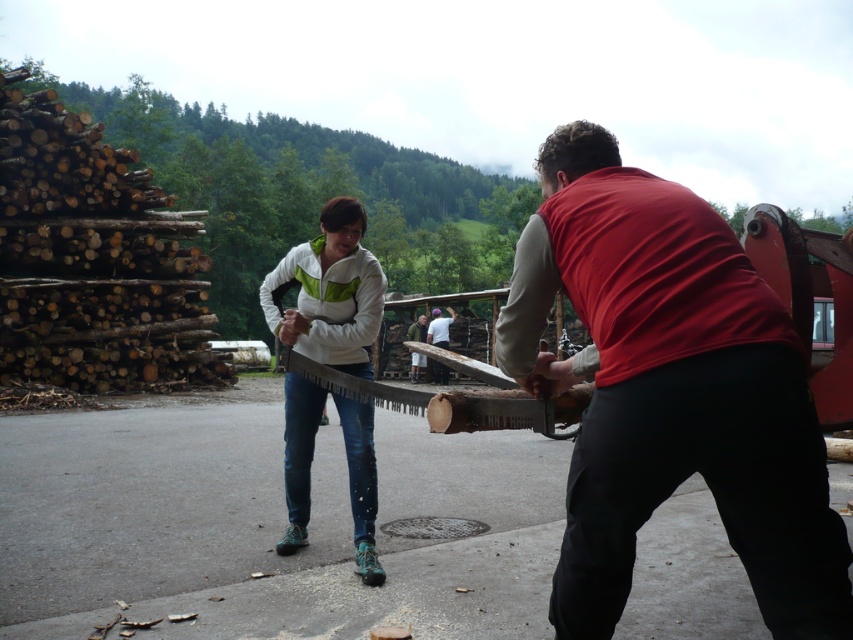
Who is positioned more to the right, white matte jacket at center or white fabric shirt at center?

white fabric shirt at center

Who is lower down, white matte jacket at center or white fabric shirt at center?

white matte jacket at center

Who is more distant from viewer, (337, 285) or (444, 380)?

The point (444, 380) is more distant.

I want to click on white matte jacket at center, so click(x=329, y=292).

Which is below, white fabric shirt at center or wooden saw at center?

white fabric shirt at center is below.

Is white fabric shirt at center below wooden saw at center?

Correct, white fabric shirt at center is located below wooden saw at center.

Locate an element on the screen. Image resolution: width=853 pixels, height=640 pixels. white fabric shirt at center is located at coordinates (439, 328).

From the picture: Does matte red vest at center have a larger size compared to white fabric shirt at center?

Indeed, matte red vest at center has a larger size compared to white fabric shirt at center.

Does matte red vest at center have a lesser height compared to white fabric shirt at center?

No, matte red vest at center is not shorter than white fabric shirt at center.

Who is more forward, (697, 362) or (434, 320)?

Point (697, 362) is more forward.

This screenshot has width=853, height=640. I want to click on matte red vest at center, so click(x=670, y=390).